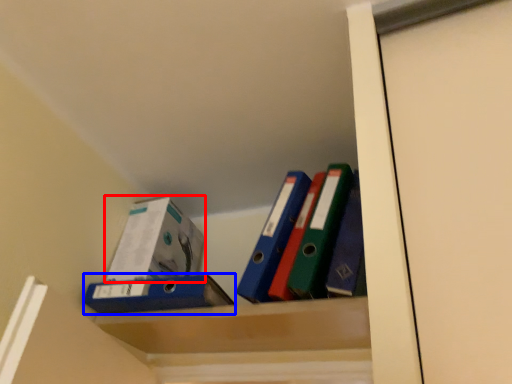
Question: Which object is closer to the camera taking this photo, box (highlighted by a red box) or paperback book (highlighted by a blue box)?

Choices:
 (A) box
 (B) paperback book

Answer: (B)